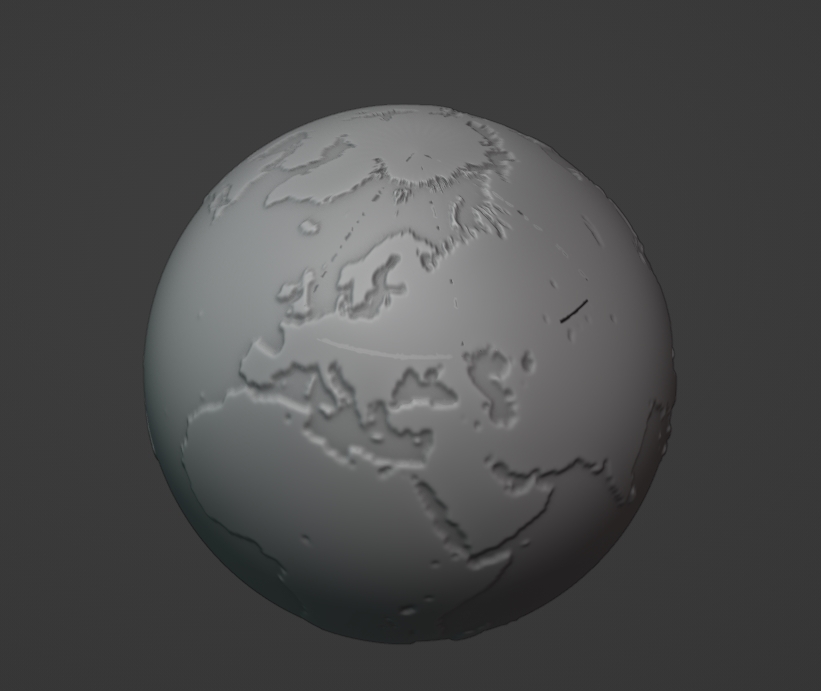
I want to click on globe, so click(424, 323).